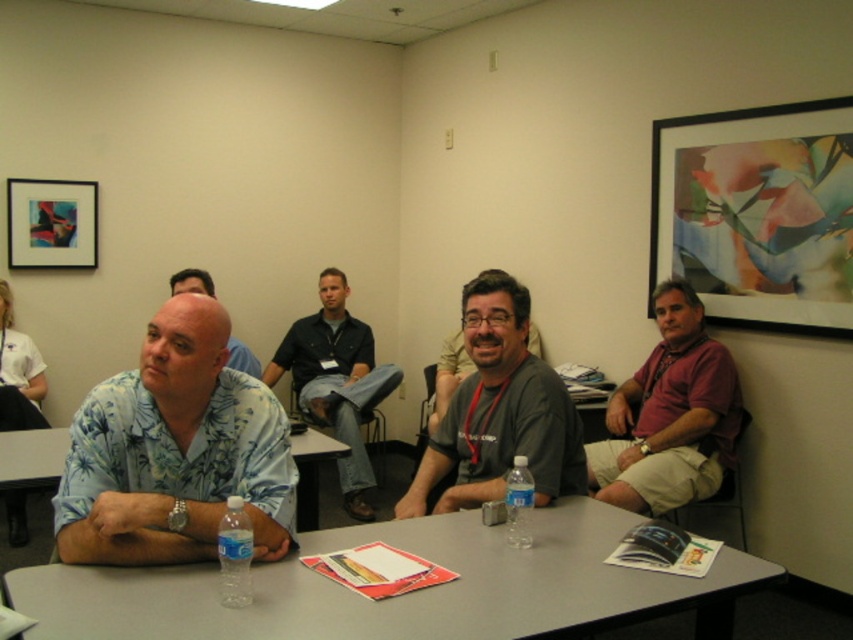
Does maroon fabric shirt at center appear on the left side of dark blue shirt at center?

In fact, maroon fabric shirt at center is to the right of dark blue shirt at center.

In the scene shown: Can you confirm if maroon fabric shirt at center is positioned to the right of dark blue shirt at center?

Yes, maroon fabric shirt at center is to the right of dark blue shirt at center.

Image resolution: width=853 pixels, height=640 pixels. Find the location of `maroon fabric shirt at center`. maroon fabric shirt at center is located at coordinates (669, 416).

Is matte plastic picture frame at upper left shorter than matte plastic table at center?

No, matte plastic picture frame at upper left is not shorter than matte plastic table at center.

Is point (48, 243) in front of point (317, 472)?

No, it is not.

At what (x,y) coordinates should I click in order to perform the action: click on matte plastic picture frame at upper left. Please return your answer as a coordinate pair (x, y). The image size is (853, 640). Looking at the image, I should click on (51, 224).

Is abstract painting at upper right thinner than blue floral shirt at center?

In fact, abstract painting at upper right might be wider than blue floral shirt at center.

Between point (740, 221) and point (199, 284), which one is positioned behind?

The point (199, 284) is behind.

Locate an element on the screen. This screenshot has width=853, height=640. abstract painting at upper right is located at coordinates (758, 212).